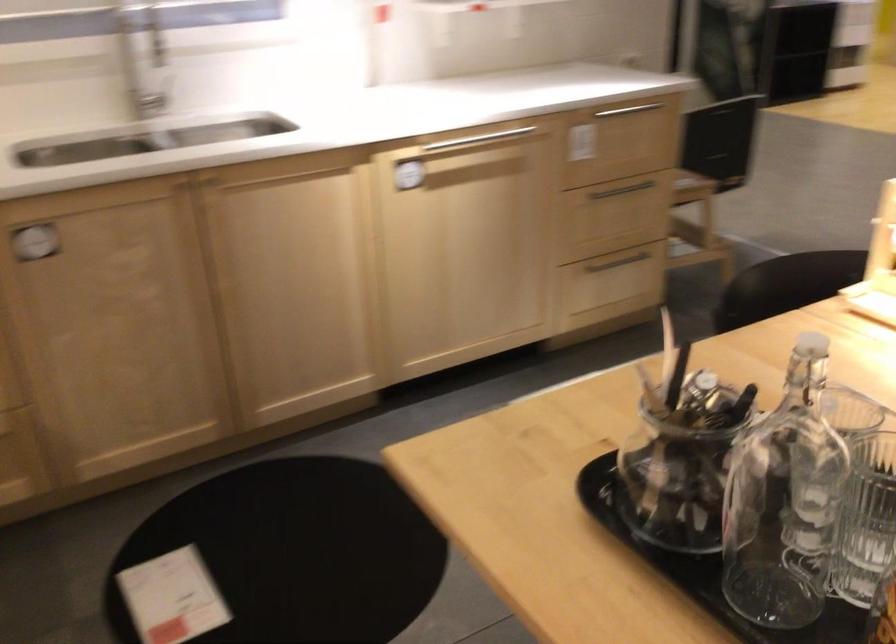
Where is `glass utensil jar`? This screenshot has width=896, height=644. glass utensil jar is located at coordinates click(x=785, y=500).